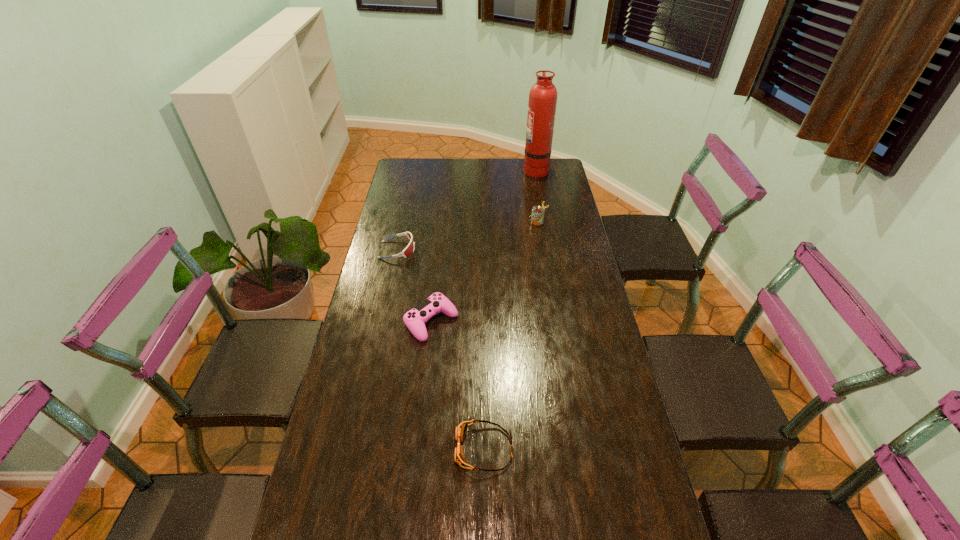
Locate an element on the screen. This screenshot has height=540, width=960. the farthest object is located at coordinates (542, 103).

Find the location of `fire extinguisher`. fire extinguisher is located at coordinates (542, 103).

Find the location of `the fourth shortest object`. the fourth shortest object is located at coordinates (537, 215).

Where is `the fourth nearest object`? the fourth nearest object is located at coordinates (537, 215).

At what (x,y) coordinates should I click in order to perform the action: click on the second nearest object. Please return your answer as a coordinate pair (x, y). This screenshot has height=540, width=960. Looking at the image, I should click on (415, 319).

You are a GUI agent. You are given a task and a screenshot of the screen. Output one action in this format:
    pyautogui.click(x=<x>, y=<y>)
    Task: Click on the fourth object from right to left
    This screenshot has height=540, width=960.
    Given the screenshot: What is the action you would take?
    415,319

This screenshot has height=540, width=960. Identify the location of the third farthest object. (409, 249).

Locate an element on the screen. This screenshot has width=960, height=540. the left goggles is located at coordinates (409, 249).

You are a GUI agent. You are given a task and a screenshot of the screen. Output one action in this format:
    pyautogui.click(x=<x>, y=<y>)
    Task: Click on the shortest object
    This screenshot has width=960, height=540.
    Given the screenshot: What is the action you would take?
    pyautogui.click(x=460, y=430)

You are a GUI agent. You are given a task and a screenshot of the screen. Output one action in this format:
    pyautogui.click(x=<x>, y=<y>)
    Task: Click on the third object from right to left
    
    Given the screenshot: What is the action you would take?
    pyautogui.click(x=460, y=430)